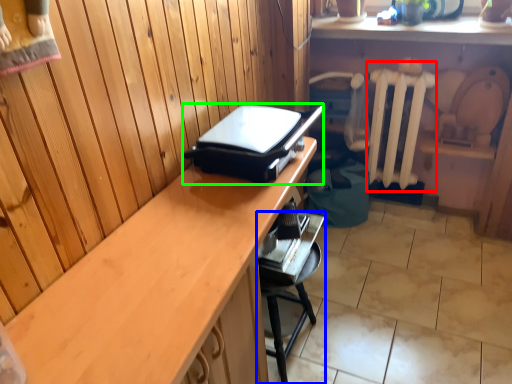
Question: Which object is positioned farthest from radiator (highlighted by a red box)? Select from furniture (highlighted by a blue box) and appliance (highlighted by a green box).

Choices:
 (A) furniture
 (B) appliance

Answer: (B)